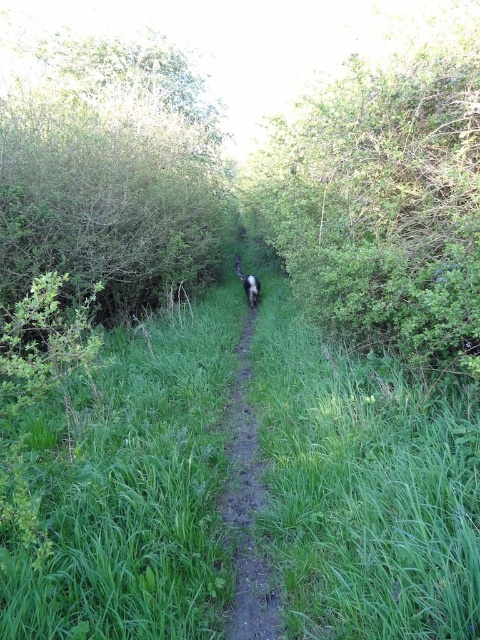
Question: Which point is farther from the camera taking this photo?

Choices:
 (A) (453, 100)
 (B) (251, 282)
 (C) (265, 568)

Answer: (B)

Question: Which object appears farthest from the camera in this image?

Choices:
 (A) black fur dog at center
 (B) green leafy bush at center
 (C) green grassy at center
 (D) green leafy tree at upper left

Answer: (A)

Question: Considering the relative positions of green leafy tree at upper left and black fur dog at center in the image provided, where is green leafy tree at upper left located with respect to black fur dog at center?

Choices:
 (A) above
 (B) below

Answer: (A)

Question: Which point is farther from the camera taking this photo?

Choices:
 (A) (144, 340)
 (B) (277, 628)

Answer: (A)

Question: Does green leafy tree at upper left appear over black fur dog at center?

Choices:
 (A) no
 (B) yes

Answer: (B)

Question: Is green grassy at center smaller than green leafy tree at upper left?

Choices:
 (A) yes
 (B) no

Answer: (A)